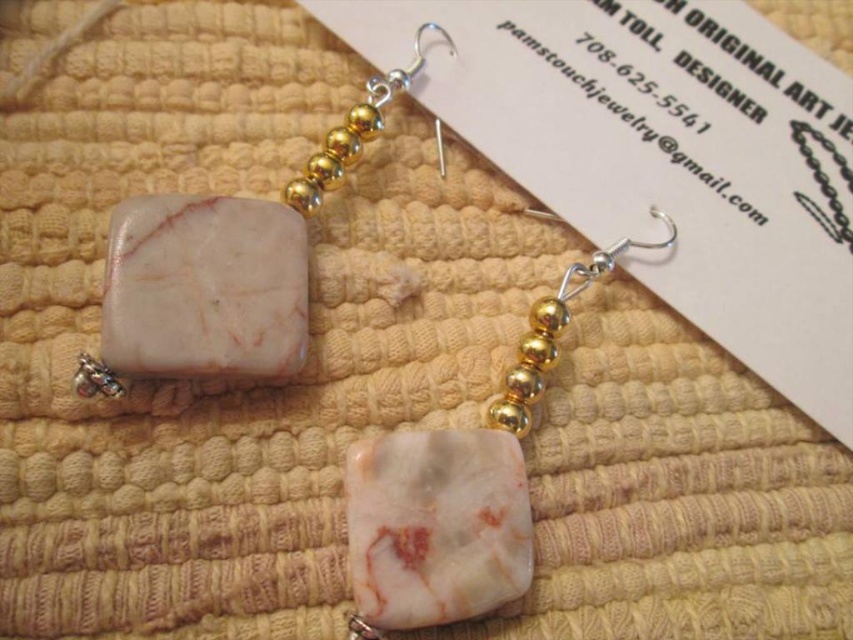
Who is lower down, white marble stone at upper left or white marble stone at center?

white marble stone at center is lower down.

Looking at this image, who is taller, white marble stone at upper left or white marble stone at center?

white marble stone at center is taller.

Between point (242, 220) and point (503, 577), which one is positioned behind?

Positioned behind is point (242, 220).

I want to click on white marble stone at upper left, so click(223, 268).